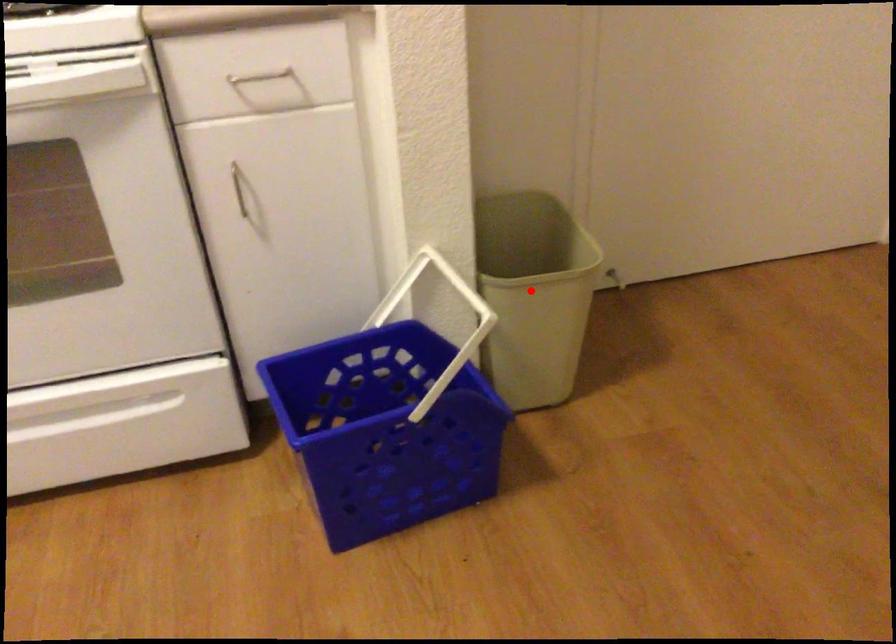
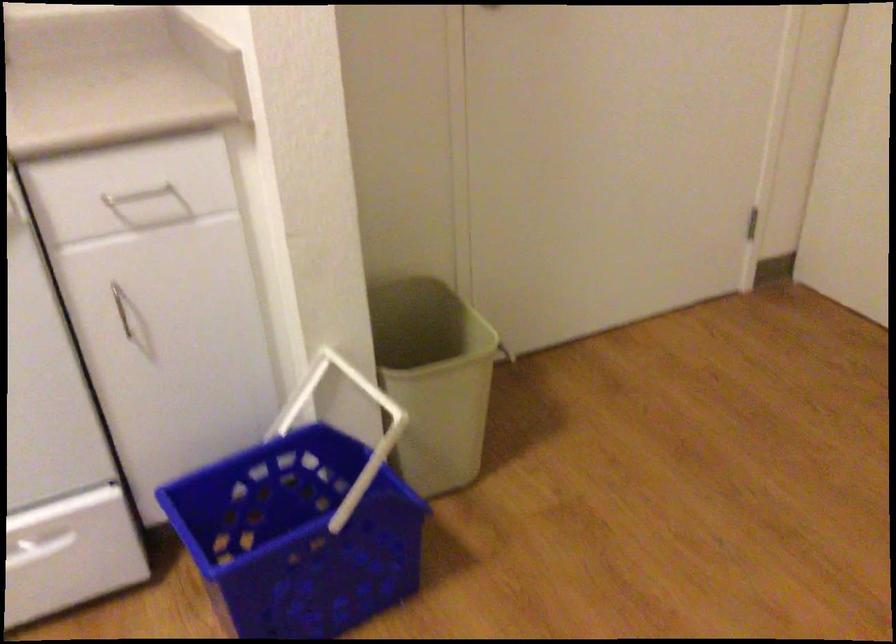
In the second image, find the point that corresponds to the highlighted location in the first image.

(434, 379)